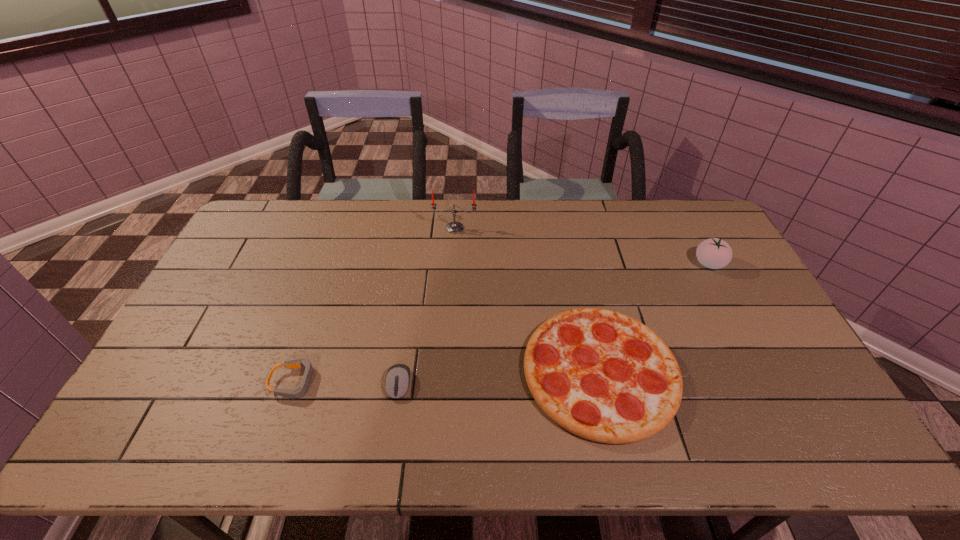
I want to click on vacant space situated on the front and back of the goggles, so click(448, 382).

The width and height of the screenshot is (960, 540). Find the location of `vacant space located on the back of the second object from right to left`. vacant space located on the back of the second object from right to left is located at coordinates (572, 249).

Where is `object at the far edge`? The width and height of the screenshot is (960, 540). object at the far edge is located at coordinates (454, 227).

The width and height of the screenshot is (960, 540). Identify the location of object at the near edge. (604, 376).

This screenshot has height=540, width=960. Find the location of `object positioned at the right edge`. object positioned at the right edge is located at coordinates (714, 253).

Find the location of a particular element. This screenshot has height=540, width=960. vacant space at the far edge of the desktop is located at coordinates (344, 208).

Identify the location of vacant area at the near edge of the desktop. The image size is (960, 540). (493, 454).

Identify the location of free space at the left edge of the desktop. (253, 249).

Identify the location of vacant area at the far left corner. (273, 222).

Locate an element on the screen. The height and width of the screenshot is (540, 960). vacant space at the near right corner of the desktop is located at coordinates (814, 426).